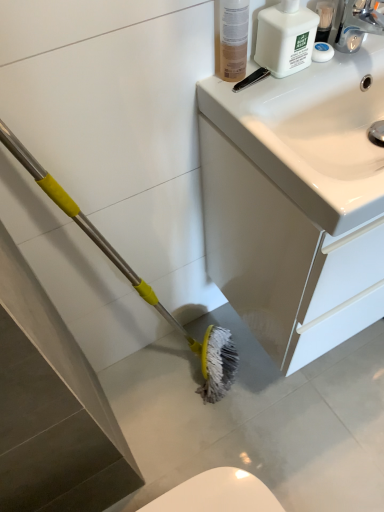
Question: Does translucent plastic bottle at upper right lie behind white plastic bottle at upper right?

Choices:
 (A) no
 (B) yes

Answer: (A)

Question: Is translucent plastic bottle at upper right looking in the opposite direction of white plastic bottle at upper right?

Choices:
 (A) yes
 (B) no

Answer: (B)

Question: Is translucent plastic bottle at upper right to the left of white plastic bottle at upper right from the viewer's perspective?

Choices:
 (A) yes
 (B) no

Answer: (A)

Question: From a real-world perspective, is translucent plastic bottle at upper right beneath white plastic bottle at upper right?

Choices:
 (A) no
 (B) yes

Answer: (A)

Question: Is translucent plastic bottle at upper right at the right side of white plastic bottle at upper right?

Choices:
 (A) yes
 (B) no

Answer: (B)

Question: Considering the relative positions of white glossy sink at upper right and translucent plastic bottle at upper right in the image provided, is white glossy sink at upper right to the left or to the right of translucent plastic bottle at upper right?

Choices:
 (A) right
 (B) left

Answer: (A)

Question: In the image, is white glossy sink at upper right positioned in front of or behind translucent plastic bottle at upper right?

Choices:
 (A) behind
 (B) front

Answer: (A)

Question: In terms of width, does white glossy sink at upper right look wider or thinner when compared to translucent plastic bottle at upper right?

Choices:
 (A) thin
 (B) wide

Answer: (B)

Question: From the image's perspective, is white glossy sink at upper right located above or below translucent plastic bottle at upper right?

Choices:
 (A) below
 (B) above

Answer: (A)

Question: Considering their positions, is translucent plastic bottle at upper right located in front of or behind white plastic bottle at upper right?

Choices:
 (A) behind
 (B) front

Answer: (B)

Question: Choose the correct answer: Is translucent plastic bottle at upper right inside white plastic bottle at upper right or outside it?

Choices:
 (A) outside
 (B) inside

Answer: (A)

Question: Based on their positions, is translucent plastic bottle at upper right located to the left or right of white plastic bottle at upper right?

Choices:
 (A) left
 (B) right

Answer: (A)

Question: From the image's perspective, is translucent plastic bottle at upper right positioned above or below white plastic bottle at upper right?

Choices:
 (A) above
 (B) below

Answer: (B)

Question: Would you say white glossy sink at upper right is to the left or to the right of white plastic bottle at upper right in the picture?

Choices:
 (A) right
 (B) left

Answer: (A)

Question: Is white glossy sink at upper right wider or thinner than white plastic bottle at upper right?

Choices:
 (A) thin
 (B) wide

Answer: (B)